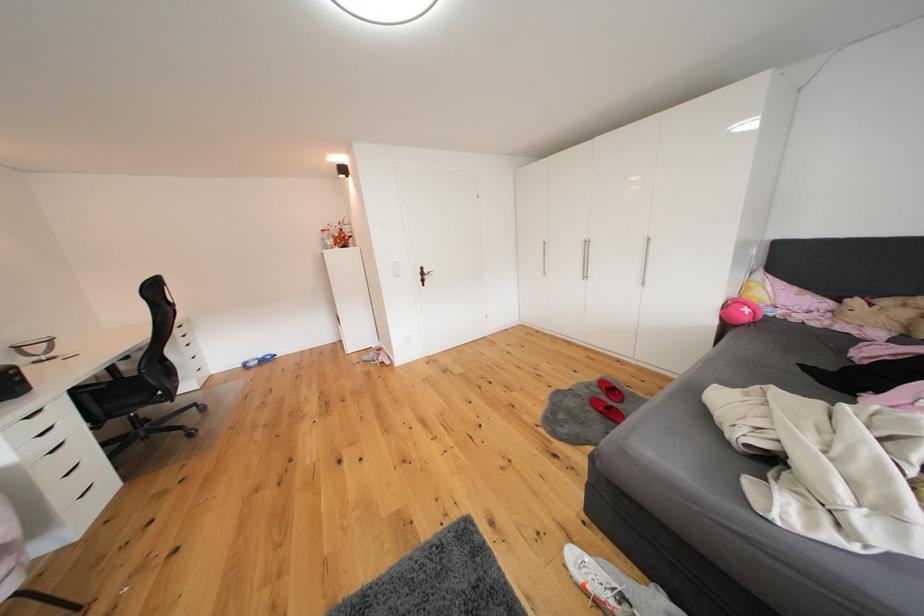
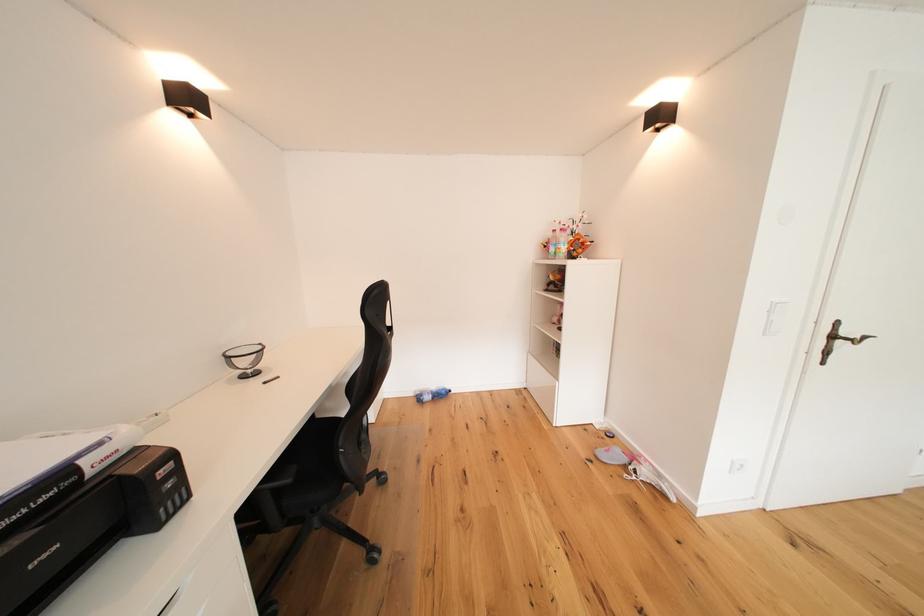
Locate, in the second image, the point that corresponds to point (432, 277) in the first image.

(843, 339)